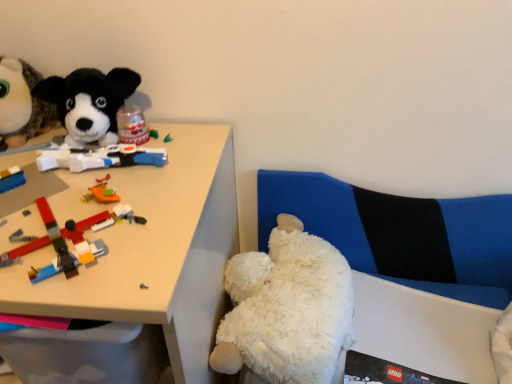
Question: Based on their positions, is white plush couch at lower right located to the left or right of black plush dog at upper left, the 1th toy viewed from the top?

Choices:
 (A) left
 (B) right

Answer: (B)

Question: From their relative heights in the image, would you say white plush couch at lower right is taller or shorter than black plush dog at upper left, the 1th toy positioned from the left?

Choices:
 (A) tall
 (B) short

Answer: (A)

Question: Estimate the real-world distances between objects in this image. Which object is farther from the black plush dog at upper left, the 1th toy positioned from the left?

Choices:
 (A) brick-like plastic toys at left, which is the 2th toy from top to bottom
 (B) white plush couch at lower right
 (C) white fluffy teddy bear at lower right, the third toy viewed from the left
 (D) white plastic desk at upper left

Answer: (B)

Question: Which object is the farthest from the white fluffy teddy bear at lower right, acting as the 3th toy starting from the top?

Choices:
 (A) white plush couch at lower right
 (B) brick-like plastic toys at left, placed as the 2th toy when sorted from bottom to top
 (C) white plastic desk at upper left
 (D) black plush dog at upper left, acting as the 3th toy starting from the right

Answer: (D)